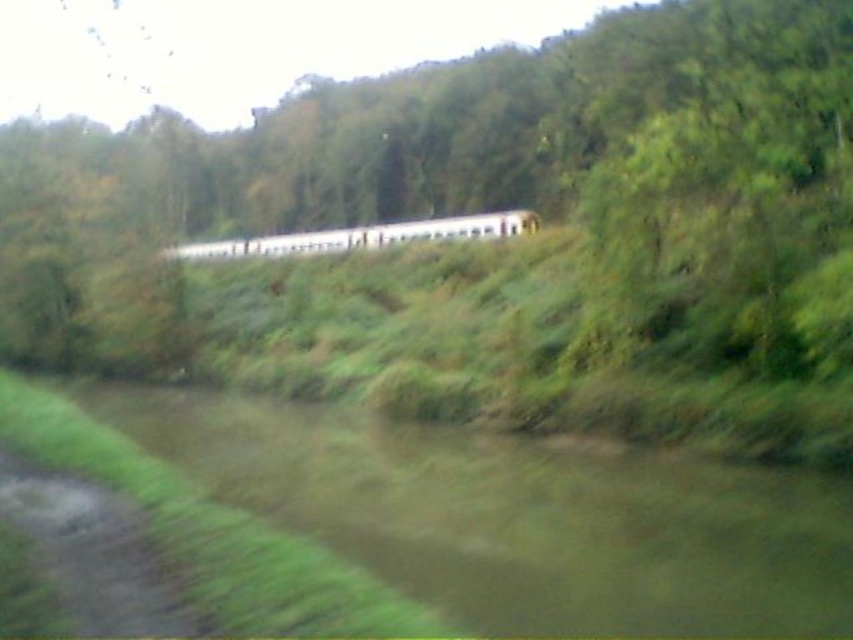
Question: Can you confirm if brown muddy river at lower left is thinner than white matte passenger train at center?

Choices:
 (A) no
 (B) yes

Answer: (B)

Question: Is brown muddy river at lower left to the right of white matte passenger train at center from the viewer's perspective?

Choices:
 (A) yes
 (B) no

Answer: (A)

Question: Which point is farther from the camera taking this photo?

Choices:
 (A) coord(434,484)
 (B) coord(358,227)

Answer: (B)

Question: Does brown muddy river at lower left have a smaller size compared to white matte passenger train at center?

Choices:
 (A) yes
 (B) no

Answer: (A)